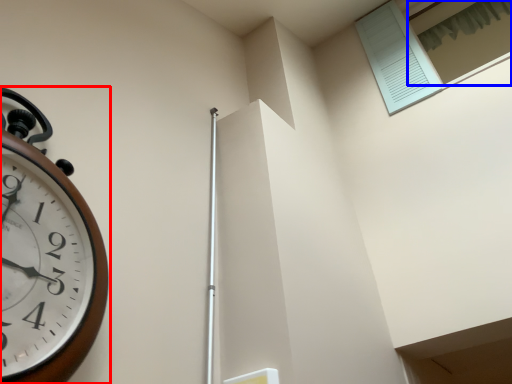
Question: Which object is closer to the camera taking this photo, wall clock (highlighted by a red box) or window (highlighted by a blue box)?

Choices:
 (A) wall clock
 (B) window

Answer: (A)